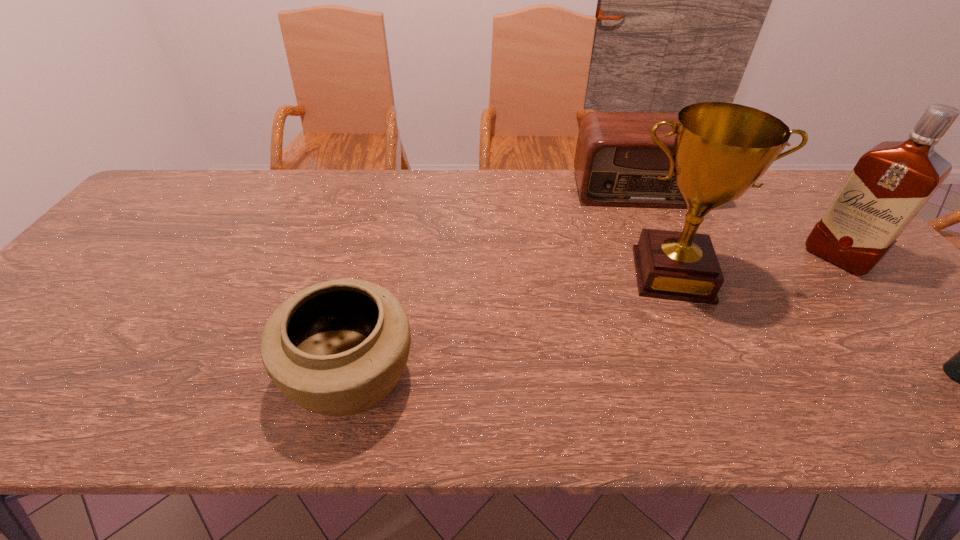
This screenshot has height=540, width=960. What are the coordinates of `pottery` in the screenshot? It's located at (336, 348).

Where is `award`? This screenshot has height=540, width=960. award is located at coordinates (721, 149).

Locate an element on the screen. The height and width of the screenshot is (540, 960). liquor is located at coordinates (890, 183).

This screenshot has height=540, width=960. In order to click on radio receiver in this screenshot , I will do `click(617, 163)`.

Find the location of a particular element. free spot located 0.340m on the back of the leftmost object is located at coordinates (387, 234).

Where is `vacant region located 0.080m on the plaque of the award`? vacant region located 0.080m on the plaque of the award is located at coordinates tap(680, 330).

Identify the location of vacant region located on the plaque of the award. Image resolution: width=960 pixels, height=540 pixels. (679, 323).

The height and width of the screenshot is (540, 960). I want to click on blank area located on the plaque of the award, so click(x=687, y=369).

I want to click on free space located on the front label of the liquor, so click(780, 310).

The height and width of the screenshot is (540, 960). Find the location of `free space located on the front label of the liquor`. free space located on the front label of the liquor is located at coordinates (751, 336).